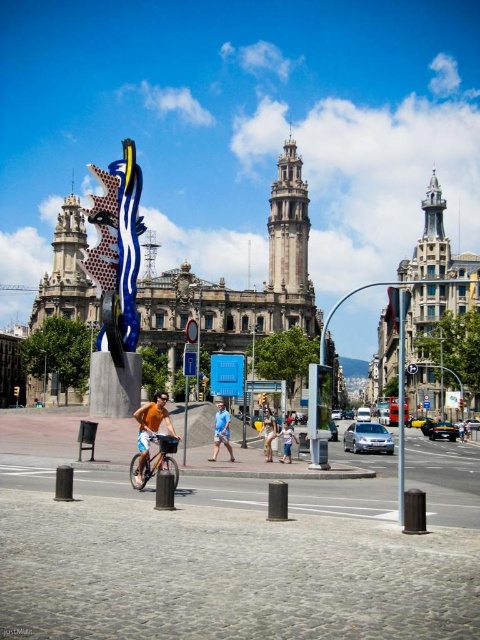
Looking at this image, who is positioned more to the left, light blue denim shorts at center or denim pants at center?

light blue denim shorts at center

Can you confirm if light blue denim shorts at center is wider than denim pants at center?

Correct, the width of light blue denim shorts at center exceeds that of denim pants at center.

The height and width of the screenshot is (640, 480). Identify the location of light blue denim shorts at center. (267, 433).

Which is above, metallic pole at center-right or light blue denim shorts at center?

metallic pole at center-right is above.

Between metallic pole at center-right and light blue denim shorts at center, which one has less height?

With less height is light blue denim shorts at center.

This screenshot has height=640, width=480. Identify the location of metallic pole at center-right. pos(400,397).

Where is `metallic pole at center-right`? This screenshot has width=480, height=640. metallic pole at center-right is located at coordinates (400, 397).

Which is in front, point (165, 406) or point (295, 442)?

Point (165, 406) is in front.

You are a GUI agent. You are given a task and a screenshot of the screen. Output one action in this format:
    pyautogui.click(x=<x>, y=<y>)
    Task: Click on the orange cotton shirt at center
    This screenshot has height=640, width=480.
    Given the screenshot: What is the action you would take?
    pyautogui.click(x=151, y=435)

Is point (176, 483) closer to viewer compared to point (283, 440)?

Yes, it is in front of point (283, 440).

I want to click on orange cotton shirt at center, so click(x=151, y=435).